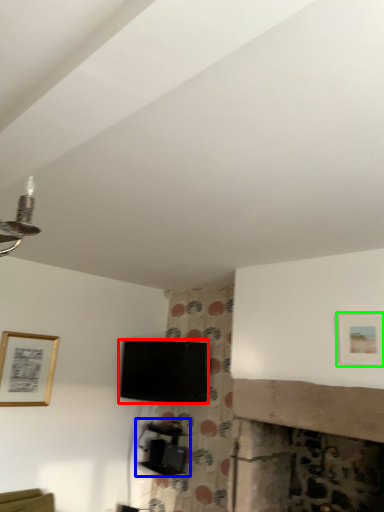
Question: Based on their relative distances, which object is nearer to television (highlighted by a red box)? Choose from furniture (highlighted by a blue box) and picture frame (highlighted by a green box).

Choices:
 (A) furniture
 (B) picture frame

Answer: (A)